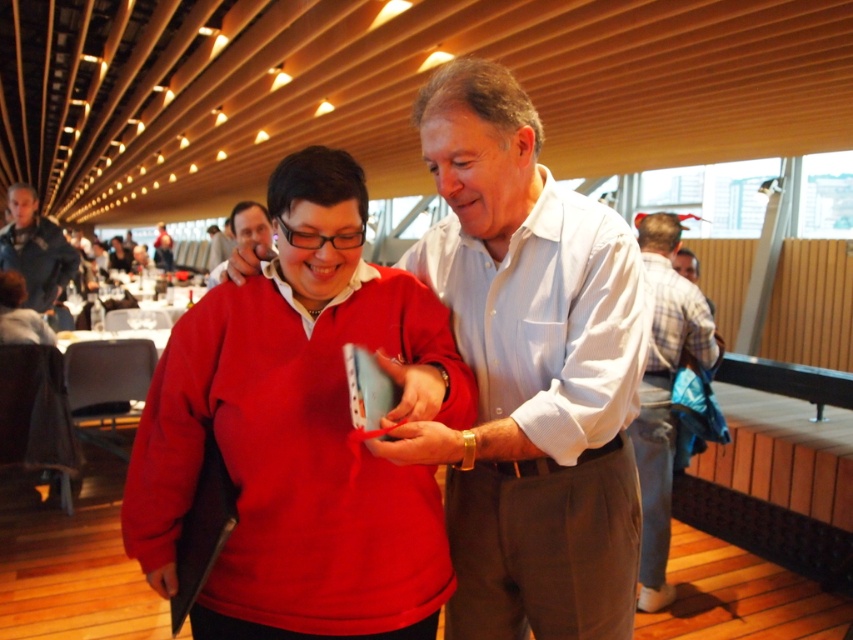
Between point (637, 467) and point (7, 228), which one is positioned in front?

Point (637, 467)

Does plaid shirt at right have a smaller size compared to dark gray jacket at left?

No.

What do you see at coordinates (663, 394) in the screenshot? I see `plaid shirt at right` at bounding box center [663, 394].

The image size is (853, 640). I want to click on plaid shirt at right, so click(663, 394).

Is light blue button-down shirt at center smaller than plaid shirt at right?

Correct, light blue button-down shirt at center occupies less space than plaid shirt at right.

Is point (543, 339) positioned after point (646, 428)?

No.

At what (x,y) coordinates should I click in order to perform the action: click on light blue button-down shirt at center. Please return your answer as a coordinate pair (x, y). Looking at the image, I should click on (x=547, y=317).

Can you confirm if light blue shirt at center is taller than light blue button-down shirt at center?

Yes.

You are a GUI agent. You are given a task and a screenshot of the screen. Output one action in this format:
    pyautogui.click(x=<x>, y=<y>)
    Task: Click on the light blue shirt at center
    The width and height of the screenshot is (853, 640).
    Given the screenshot: What is the action you would take?
    pyautogui.click(x=529, y=372)

Does point (624, 483) come in front of point (538, 420)?

No, it is behind (538, 420).

You are a GUI agent. You are given a task and a screenshot of the screen. Output one action in this format:
    pyautogui.click(x=<x>, y=<y>)
    Task: Click on the light blue shirt at center
    Image resolution: width=853 pixels, height=640 pixels.
    Given the screenshot: What is the action you would take?
    pyautogui.click(x=529, y=372)